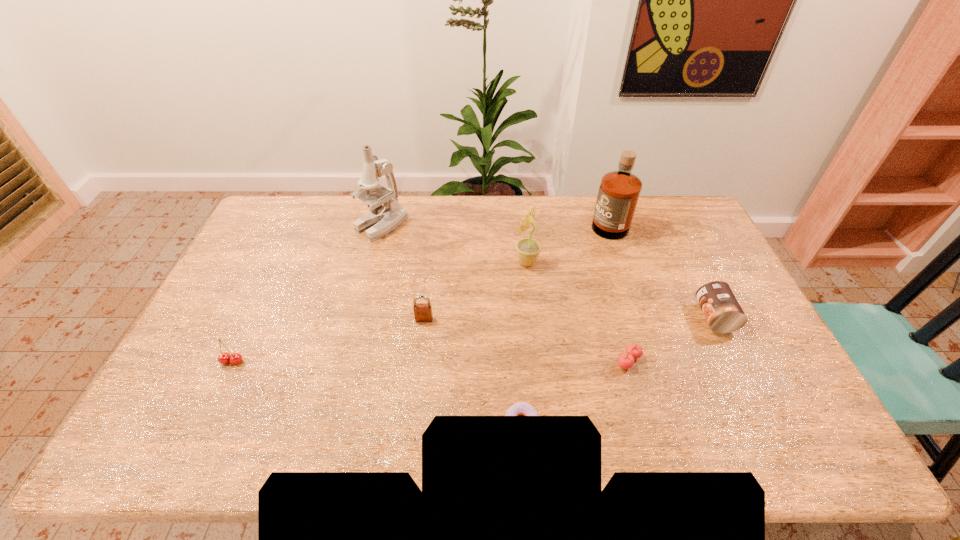
Locate an element on the screen. The image size is (960, 540). free region at the far edge of the desktop is located at coordinates (432, 208).

In order to click on vacant space at the near edge in this screenshot , I will do `click(736, 428)`.

Locate an element on the screen. Image resolution: width=960 pixels, height=540 pixels. vacant space at the left edge is located at coordinates (229, 301).

The width and height of the screenshot is (960, 540). In the image, there is a desktop. What are the coordinates of `vacant space at the right edge` in the screenshot? It's located at (720, 258).

In the image, there is a desktop. Where is `vacant area at the far right corner`? The width and height of the screenshot is (960, 540). vacant area at the far right corner is located at coordinates (688, 219).

Locate an element on the screen. This screenshot has width=960, height=540. vacant space that's between the sunflower and the third object from left to right is located at coordinates (475, 291).

What are the coordinates of `free spot between the padlock and the liquor` in the screenshot? It's located at click(516, 269).

I want to click on vacant space in between the nearest object and the leftmost object, so click(x=377, y=392).

In order to click on vacant area between the shortest object and the liquor in this screenshot , I will do `click(564, 321)`.

Locate an element on the screen. The height and width of the screenshot is (540, 960). free spot between the nearest object and the microscope is located at coordinates (451, 323).